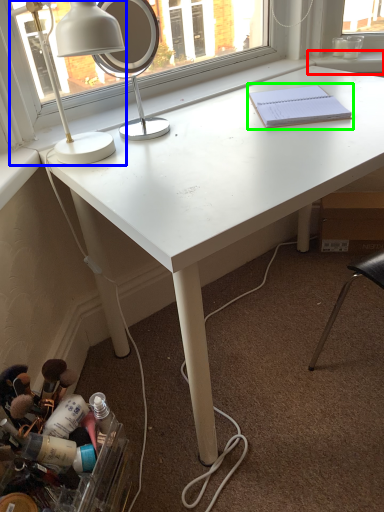
Question: Considering the real-world distances, which object is farthest from window sill (highlighted by a red box)? lamp (highlighted by a blue box) or notebook (highlighted by a green box)?

Choices:
 (A) lamp
 (B) notebook

Answer: (A)